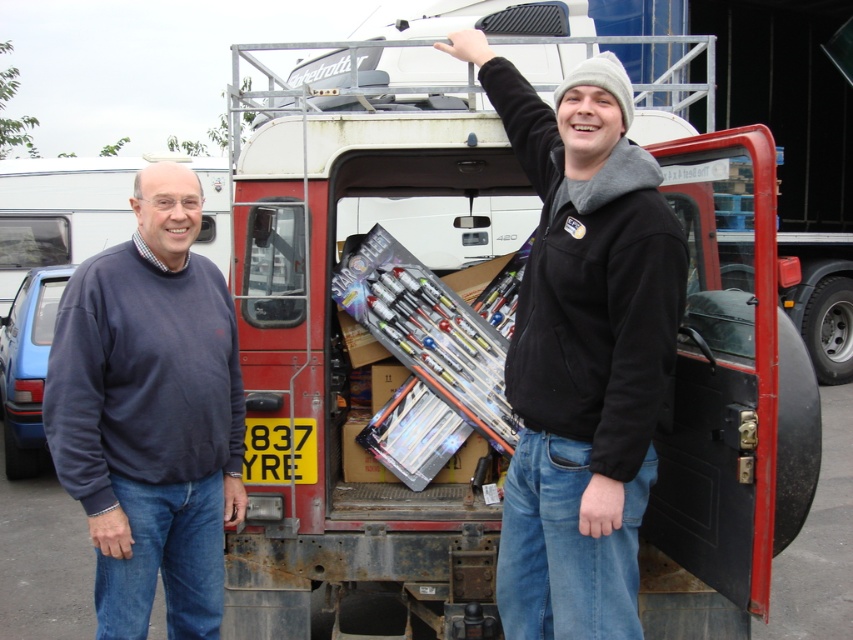
You are standing at the camera position and want to reach point (364, 561). If your walking speed is 1.2 meters per second, how many seconds will it take you to reach there?

The distance between the camera and point (364, 561) is 3.55 meters. At a speed of 1.2 meters per second, it would take approximately 2.96 seconds to reach there.

You are a delivery driver who needs to place a new tool kit in the Land Rover. The toolbox must be placed at point (582, 349). What object is already present at that location?

The metallic silver toolbox at upper center is already present at point (582, 349).